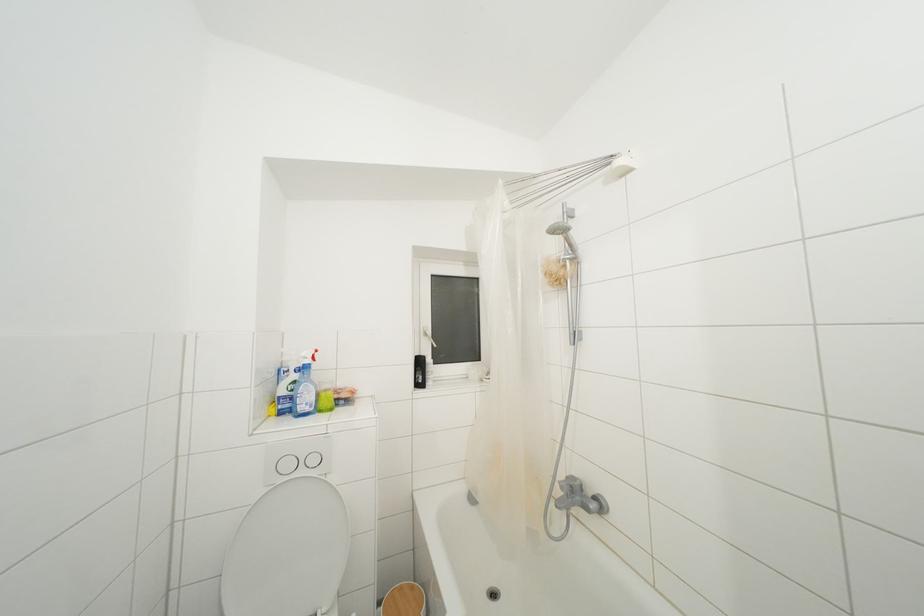
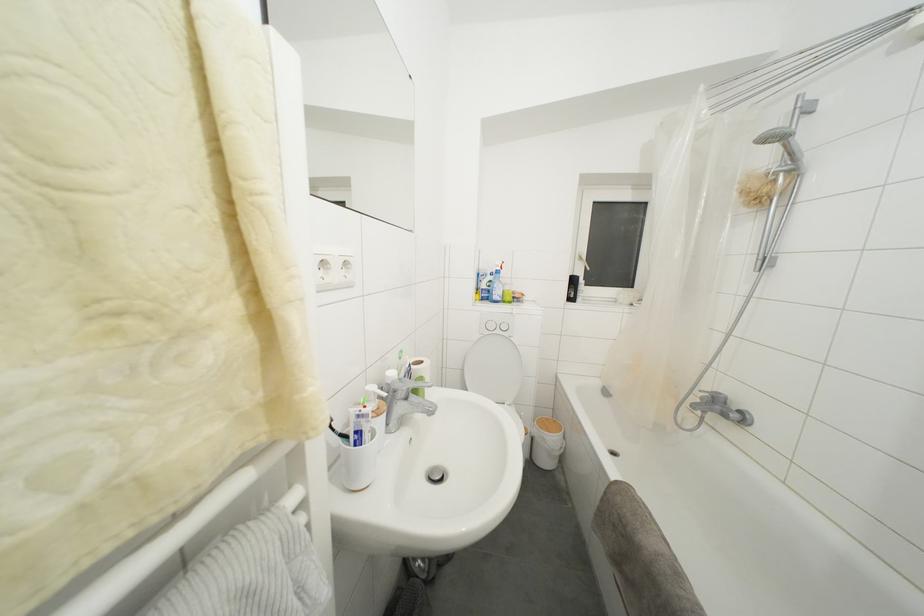
The first image is from the beginning of the video and the second image is from the end. How did the camera likely rotate when shooting the video?

The rotation direction of the camera is left-down.